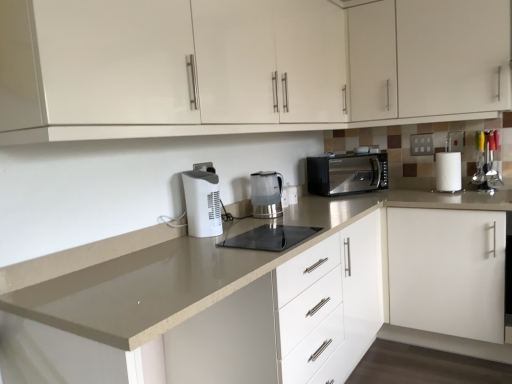
Question: Does point (501, 44) appear closer or farther from the camera than point (267, 225)?

Choices:
 (A) closer
 (B) farther

Answer: (B)

Question: From their relative heights in the image, would you say white glossy cabinet at upper center, which is counted as the 2th cabinetry, starting from the bottom, is taller or shorter than black glass cooktop at center?

Choices:
 (A) tall
 (B) short

Answer: (A)

Question: Which object is the farthest from the white glossy cabinet at upper center, arranged as the 3th cabinetry when ordered from the bottom?

Choices:
 (A) white glossy cabinet at upper center, which is counted as the second cabinetry, starting from the top
 (B) white matte paper towel at right
 (C) white matte cabinet at right, which ranks as the 1th cabinetry in bottom-to-top order
 (D) transparent plastic kettle at center, placed as the first home appliance when sorted from back to front
 (E) beige laminate countertop at center

Answer: (D)

Question: Estimate the real-world distances between objects in this image. Which object is closer to the transparent plastic kettle at center, which is the first home appliance in right-to-left order?

Choices:
 (A) beige laminate countertop at center
 (B) white glossy cabinet at upper center, which is the first cabinetry from top to bottom
 (C) black glass cooktop at center
 (D) white plastic humidifier at center, which appears as the second home appliance when viewed from the back
 (E) white matte paper towel at right

Answer: (C)